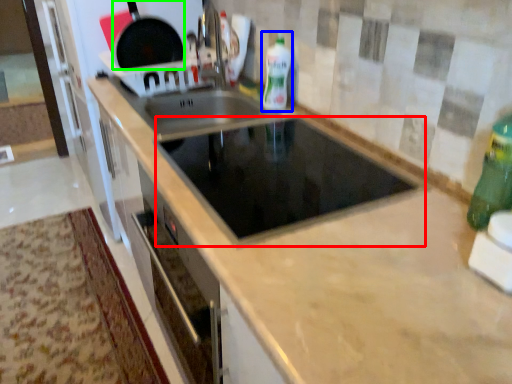
Question: Which is nearer to the appliance (highlighted by a red box)? bottle (highlighted by a blue box) or frying pan (highlighted by a green box).

Choices:
 (A) bottle
 (B) frying pan

Answer: (A)